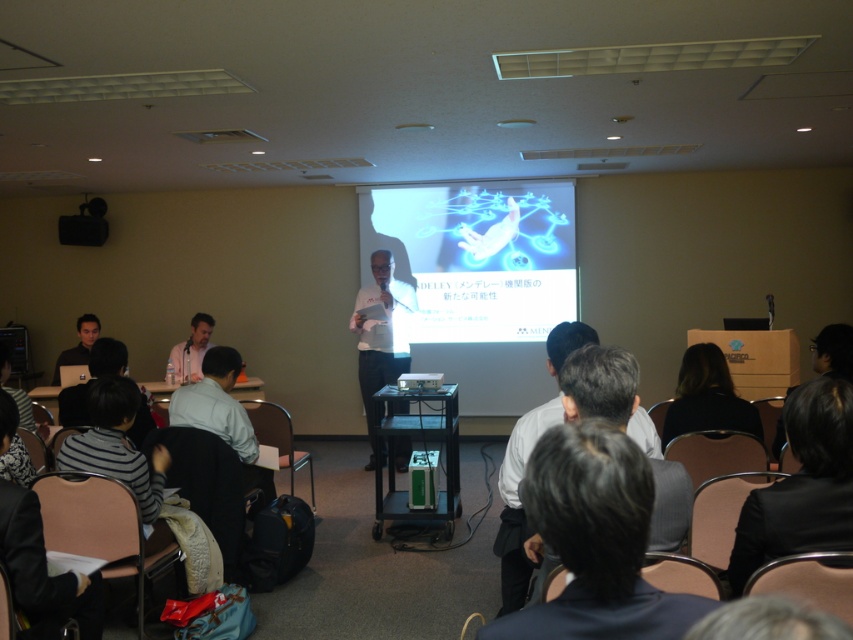
You are an attendee at the conference and want to borrow a laptop charger. You see the black hair at lower right and the matte black laptop at lower left. Which object is closer to your right side?

The black hair at lower right is to the right of the matte black laptop at lower left, so the black hair at lower right is closer to your right side.

You are organizing a small event and need to place a 1.2 meter wide table between the dark gray suit at center and the black glossy box at lower right. Can the table fit in the space between them?

The dark gray suit at center is wider than the black glossy box at lower right. However, since the table is 1.2 meters wide, we need to know the actual width of the space between them to determine if it can fit. The provided information only states that the dark gray suit at center is wider, but does not specify the exact width of the space. Therefore, it is unclear if the table will fit without additional measurements.

You are an attendee sitting in the back row of the conference room. You want to take a photo of the presenter wearing the dark gray suit at center using your phone. Is the presenter within your field of view if you are looking straight ahead?

The dark gray suit at center is located at point (595, 540), which is within the central area of the room. Since you are looking straight ahead from the back row, the presenter should be within your field of view.